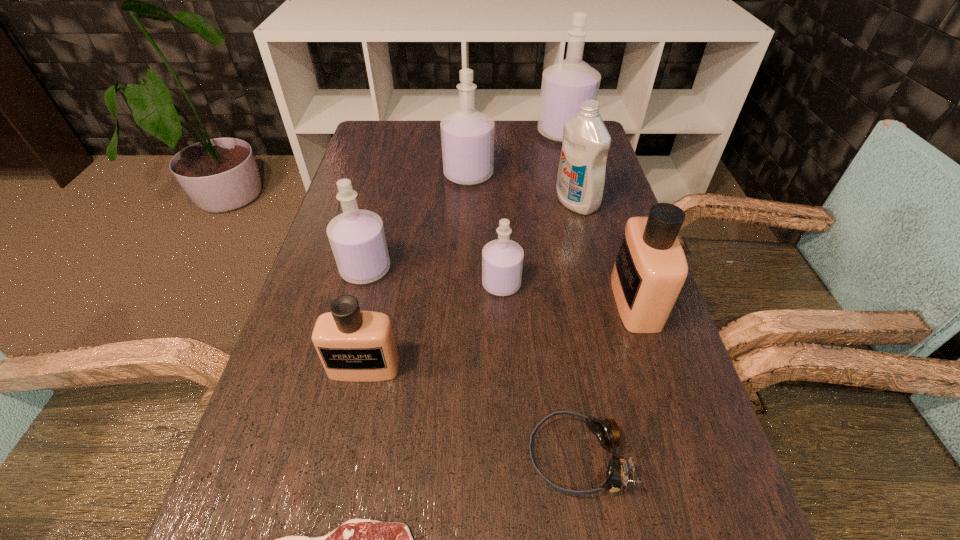
Identify the location of the tallest perfume. (565, 85).

Identify the location of the biggest purple perfume. (565, 85).

The image size is (960, 540). Identify the location of the second tallest perfume. (467, 135).

You are a GUI agent. You are given a task and a screenshot of the screen. Output one action in this format:
    pyautogui.click(x=<x>, y=<y>)
    Task: Click on the second biggest purple perfume
    The height and width of the screenshot is (540, 960).
    Given the screenshot: What is the action you would take?
    pyautogui.click(x=467, y=135)

Where is `white detergent`? The image size is (960, 540). white detergent is located at coordinates (580, 183).

The image size is (960, 540). Identify the location of the leftmost purple perfume. (357, 238).

Where is `the farther beige perfume`? Image resolution: width=960 pixels, height=540 pixels. the farther beige perfume is located at coordinates (650, 269).

At what (x,y) coordinates should I click in order to perform the action: click on the right beige perfume. Please return your answer as a coordinate pair (x, y). Looking at the image, I should click on (650, 269).

Find the location of `the smallest purple perfume`. the smallest purple perfume is located at coordinates (502, 259).

Locate an element on the screen. the smaller beige perfume is located at coordinates (354, 346).